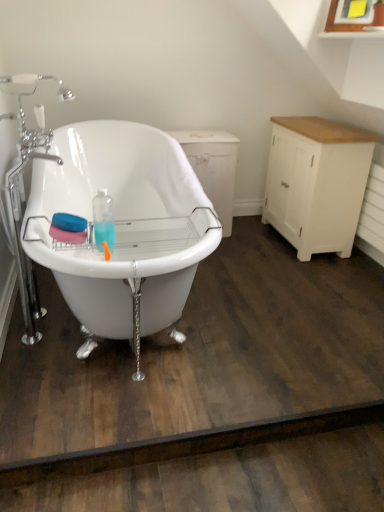
The image size is (384, 512). What are the coordinates of `vacant space that's between white painted wood cabinet at right and white glossy bathtub at center` in the screenshot? It's located at (257, 288).